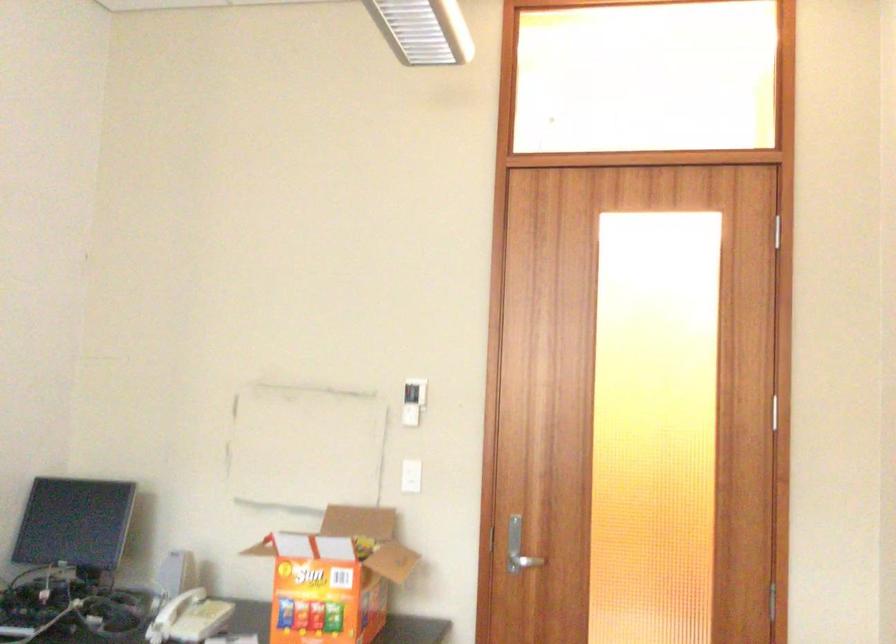
This screenshot has height=644, width=896. I want to click on white light switch, so click(x=412, y=401).